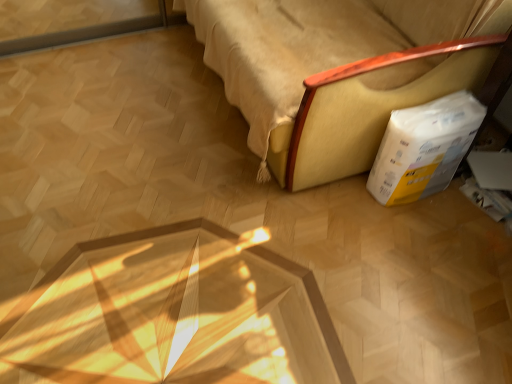
I want to click on vacant space situated on the left part of white/yellow cardboard box at lower right, so click(348, 201).